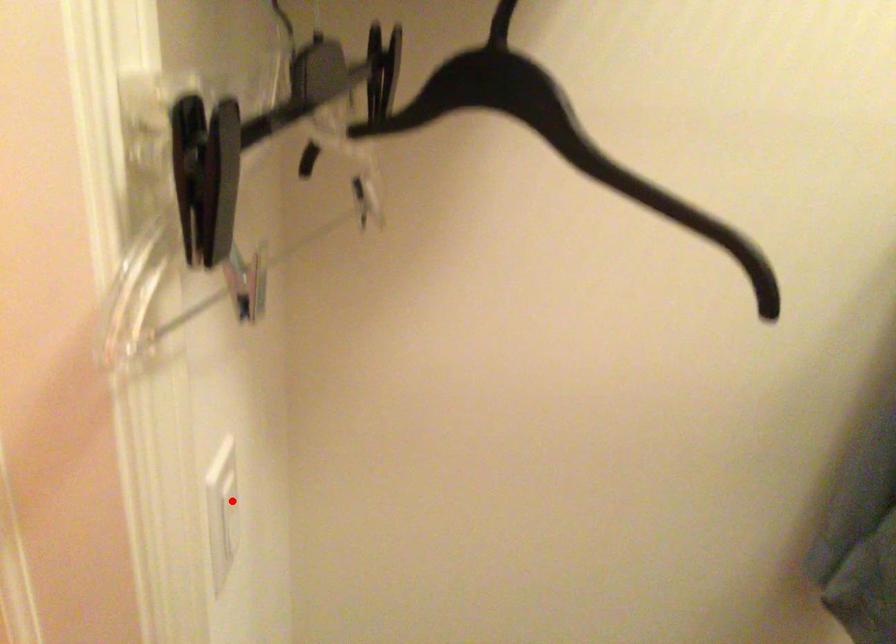
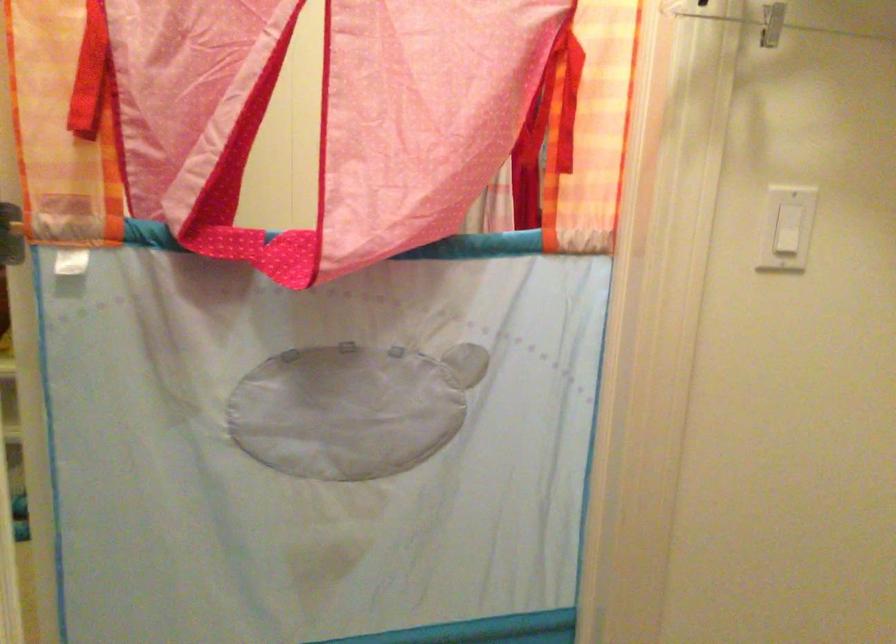
The point at the highlighted location is marked in the first image. Where is the corresponding point in the second image?

(787, 230)